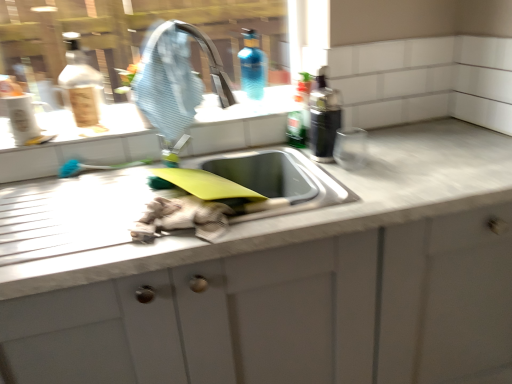
Question: In terms of height, does white marble countertop at center look taller or shorter compared to white glossy sink at upper center?

Choices:
 (A) tall
 (B) short

Answer: (A)

Question: Is white marble countertop at center to the left or to the right of white glossy sink at upper center in the image?

Choices:
 (A) left
 (B) right

Answer: (B)

Question: Which of these objects is positioned farthest from the black plastic bottle at upper right, which appears as the first bottle when viewed from the right?

Choices:
 (A) white glossy sink at upper center
 (B) blue glass bottle at upper center, which is the first bottle in left-to-right order
 (C) transparent glass window at upper center
 (D) blue rubber tap at upper center
 (E) white marble countertop at center

Answer: (C)

Question: Estimate the real-world distances between objects in this image. Which object is closer to the white glossy sink at upper center?

Choices:
 (A) blue rubber tap at upper center
 (B) white marble countertop at center
 (C) green glass bottle at upper right, which is counted as the 2th bottle, starting from the left
 (D) blue glass bottle at upper center, arranged as the third bottle when viewed from the right
 (E) transparent glass window at upper center

Answer: (A)